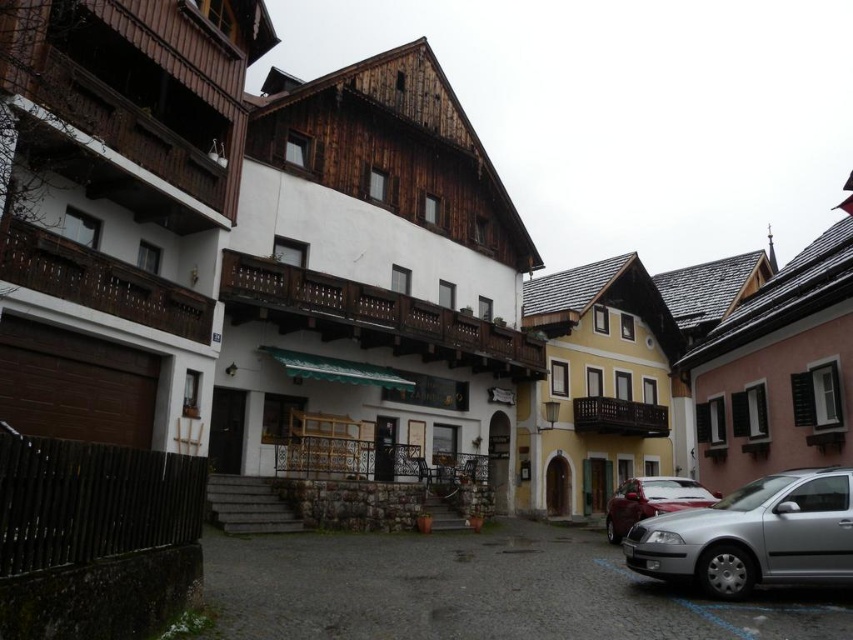
Question: Can you confirm if silver metallic car at lower right is wider than shiny red car at lower right?

Choices:
 (A) yes
 (B) no

Answer: (B)

Question: Which point is farther to the camera?

Choices:
 (A) (662, 568)
 (B) (621, 525)

Answer: (B)

Question: Is silver metallic car at lower right bigger than shiny red car at lower right?

Choices:
 (A) no
 (B) yes

Answer: (A)

Question: Is silver metallic car at lower right further to the viewer compared to shiny red car at lower right?

Choices:
 (A) no
 (B) yes

Answer: (A)

Question: Which point is closer to the camera taking this photo?

Choices:
 (A) (664, 564)
 (B) (636, 513)

Answer: (A)